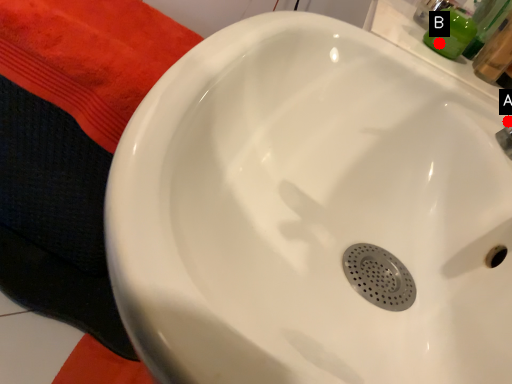
Question: Two points are circled on the image, labeled by A and B beside each circle. Which point is closer to the camera?

Choices:
 (A) A is closer
 (B) B is closer

Answer: (A)